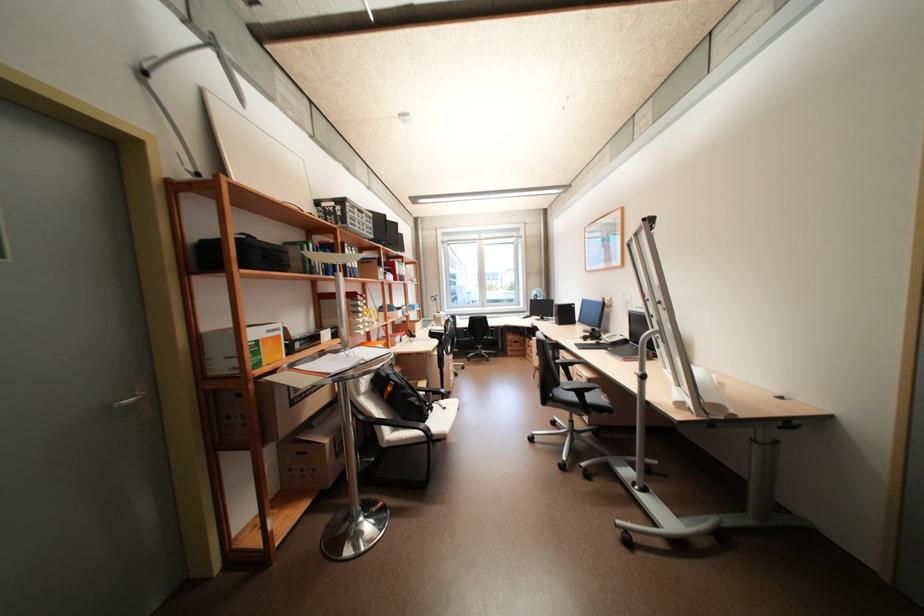
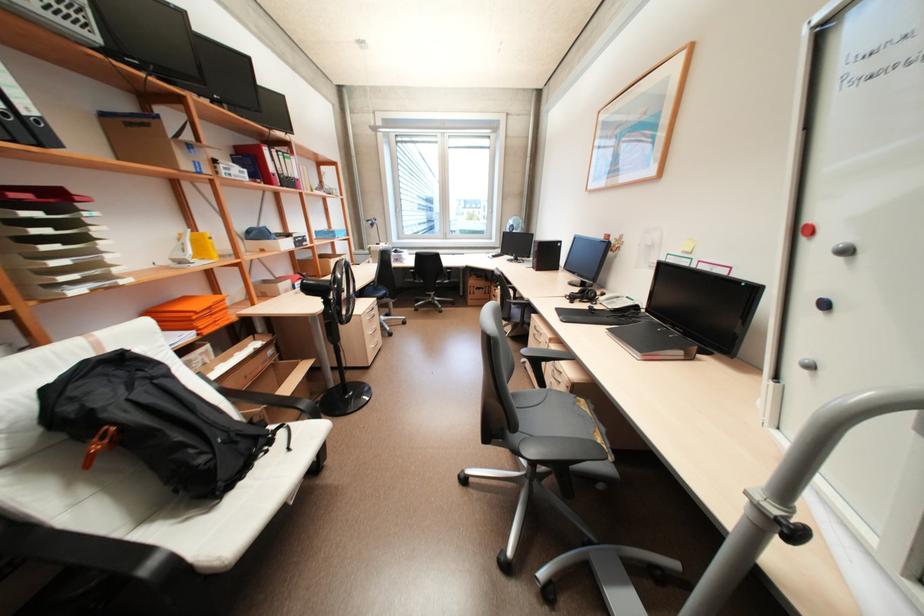
The point at (x=603, y=338) is marked in the first image. Where is the corresponding point in the second image?

(598, 299)